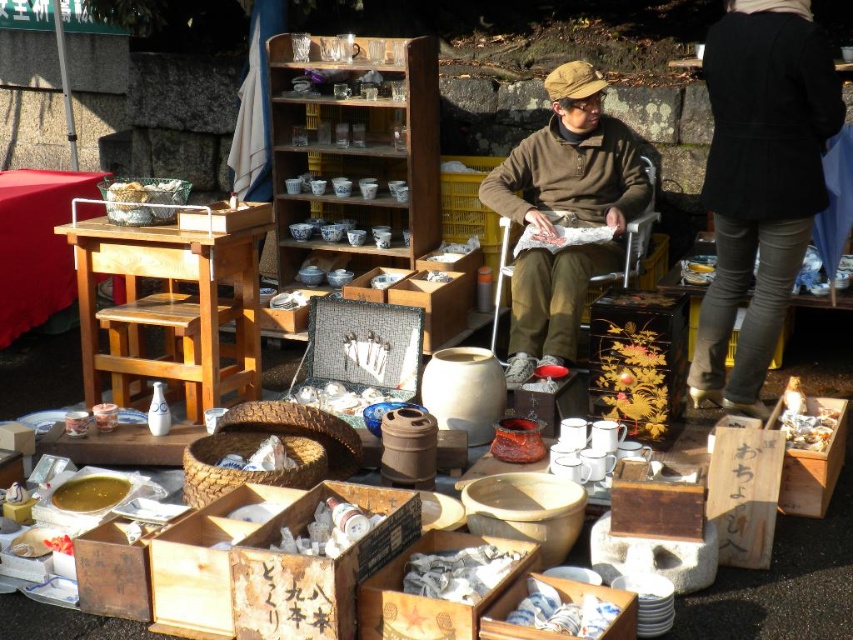
Who is higher up, black wool coat at upper right or golden liquid at lower left?

black wool coat at upper right is higher up.

Which is in front, point (717, 324) or point (93, 474)?

Point (93, 474) is in front.

Between point (787, 96) and point (84, 490), which one is positioned in front?

Point (84, 490) is more forward.

The height and width of the screenshot is (640, 853). I want to click on black wool coat at upper right, so click(x=759, y=182).

The height and width of the screenshot is (640, 853). What do you see at coordinates (90, 492) in the screenshot? I see `golden liquid at lower left` at bounding box center [90, 492].

Does point (107, 497) lie in front of point (808, 428)?

Yes, point (107, 497) is in front of point (808, 428).

Which is behind, point (114, 490) or point (801, 417)?

Positioned behind is point (801, 417).

At what (x,y) coordinates should I click in order to perform the action: click on golden liquid at lower left. Please return your answer as a coordinate pair (x, y). The width and height of the screenshot is (853, 640). Looking at the image, I should click on (90, 492).

Where is `black wool coat at upper right`? The width and height of the screenshot is (853, 640). black wool coat at upper right is located at coordinates (759, 182).

Does black wool coat at upper right have a smaller size compared to brown woolen sweater at center?

Yes, black wool coat at upper right is smaller than brown woolen sweater at center.

This screenshot has height=640, width=853. In order to click on black wool coat at upper right in this screenshot , I will do `click(759, 182)`.

The width and height of the screenshot is (853, 640). Identify the location of black wool coat at upper right. (759, 182).